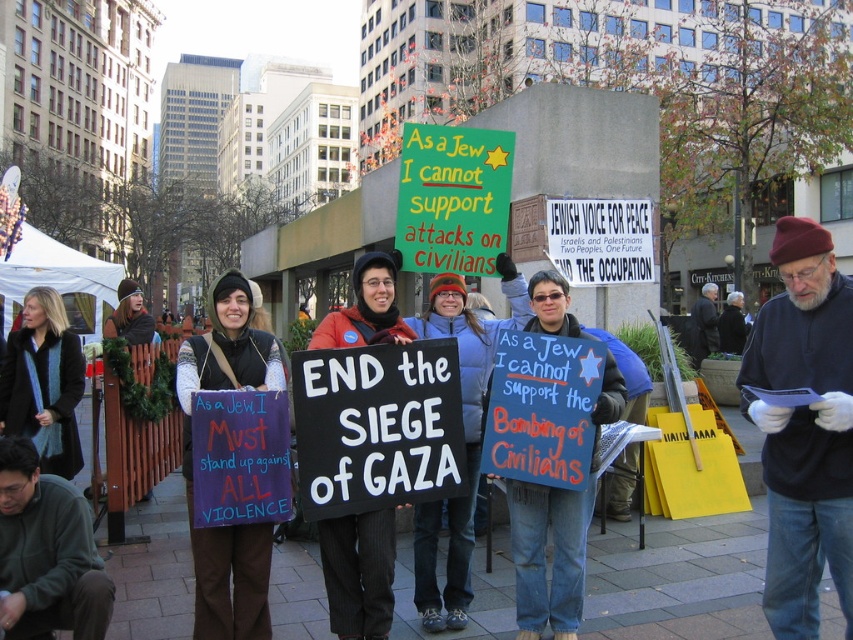
You are a photographer trying to capture a closeup of the dark blue sweater at center and the purple fabric sign at center in the protest scene. Which object should you zoom in on first to ensure it fits entirely in your frame before adjusting for the other?

The dark blue sweater at center is smaller than the purple fabric sign at center, so you should zoom in on the dark blue sweater at center first to ensure it fits in the frame before adjusting for the larger purple fabric sign at center.

Based on the scene description, where is the purple fabric sign at center located in terms of its 2D coordinates?

The purple fabric sign at center is located at the 2D coordinates of point (192, 458).

What is the spatial relationship between the dark blue sweater at center and the black pinstripe pants at center in the protest scene?

The dark blue sweater at center is taller than the black pinstripe pants at center.